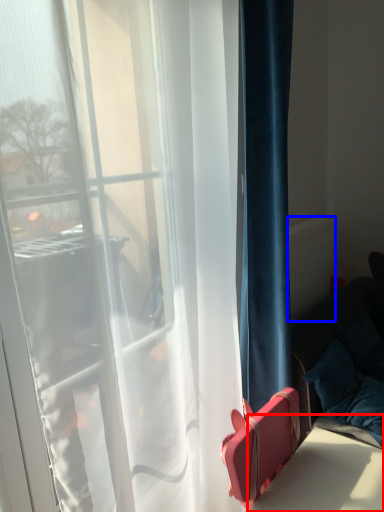
Question: Which point is closer to the camera, table (highlighted by a red box) or radiator (highlighted by a blue box)?

Choices:
 (A) table
 (B) radiator

Answer: (A)